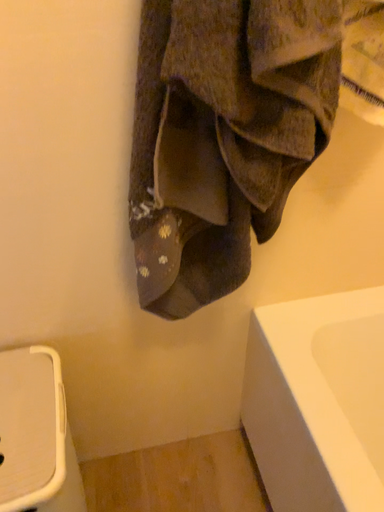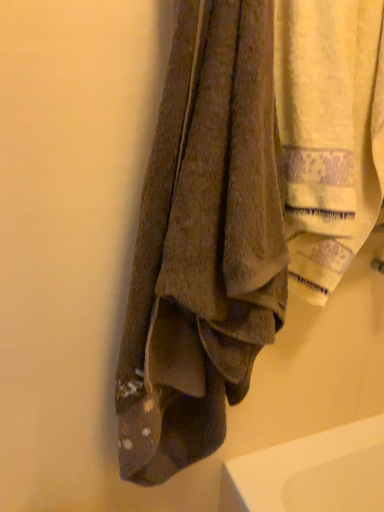
Question: How did the camera likely rotate when shooting the video?

Choices:
 (A) rotated upward
 (B) rotated downward

Answer: (A)